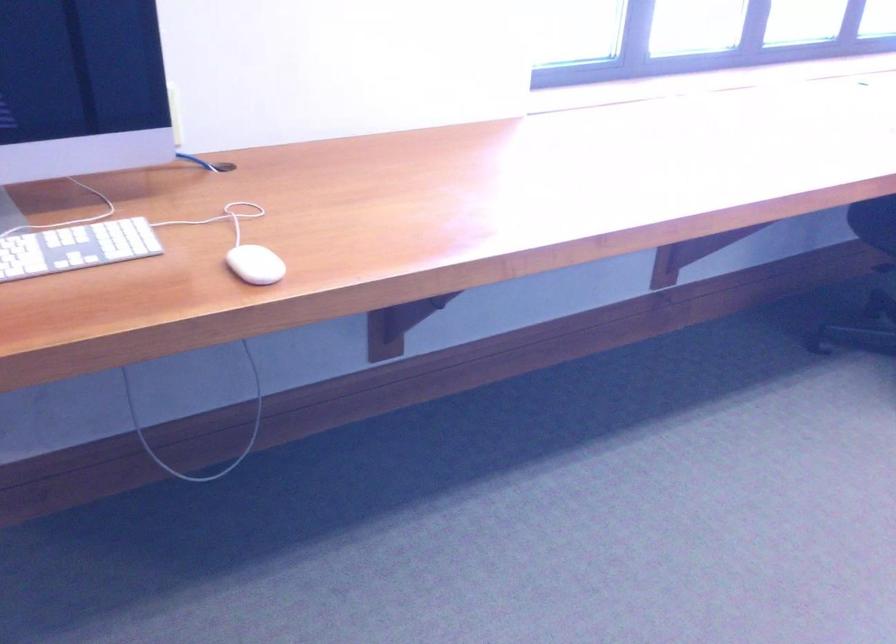
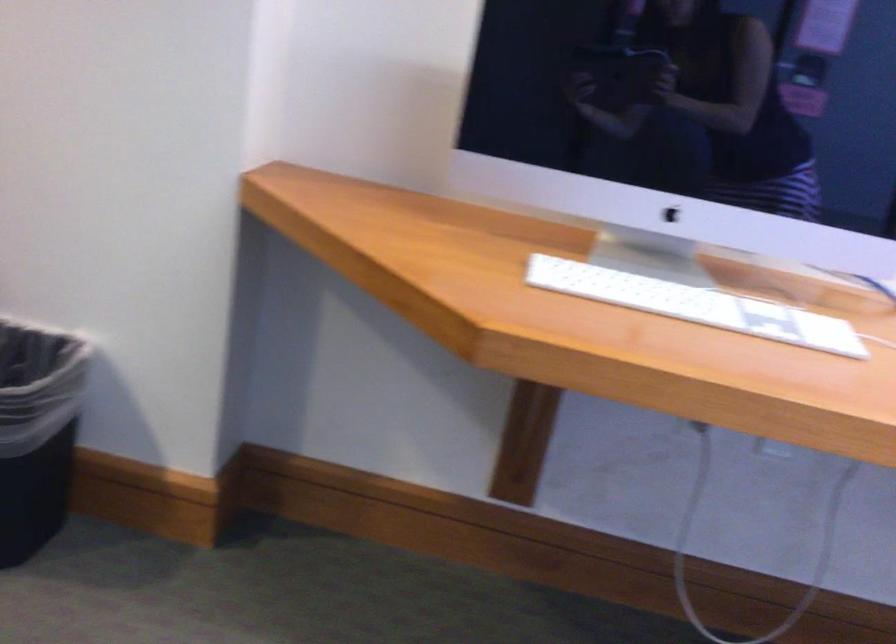
Question: The camera is either moving clockwise (left) or counter-clockwise (right) around the object. The first image is from the beginning of the video and the second image is from the end. Is the camera moving left or right when shooting the video?

Choices:
 (A) Left
 (B) Right

Answer: (B)